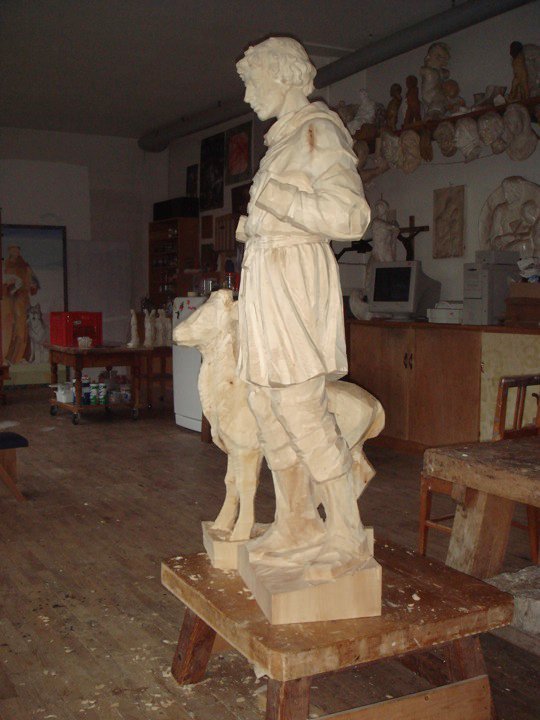
Where is `computer monitor`? The width and height of the screenshot is (540, 720). computer monitor is located at coordinates (394, 288).